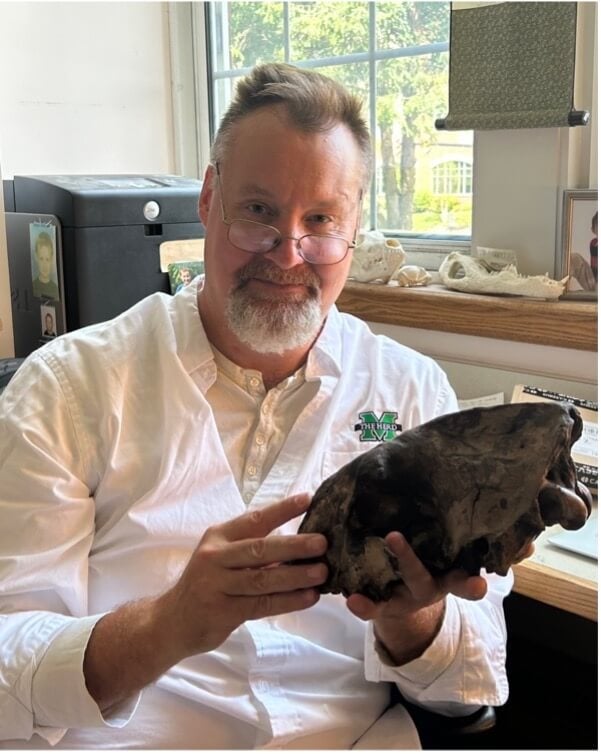
This screenshot has height=754, width=601. In order to click on table in this screenshot , I will do `click(560, 602)`.